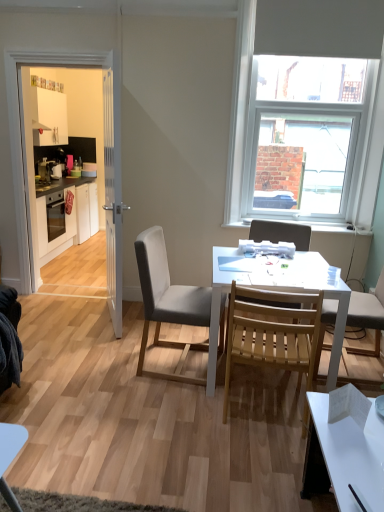
Question: Is point coord(109,138) closer or farther from the camera than point coord(307,355)?

Choices:
 (A) closer
 (B) farther

Answer: (B)

Question: From their relative heights in the image, would you say white wooden door at left is taller or shorter than natural wood chair at center, the 2th chair when ordered from left to right?

Choices:
 (A) short
 (B) tall

Answer: (B)

Question: Which object is the farthest from the white matte window at upper right?

Choices:
 (A) white wooden door at left
 (B) metallic silver toaster at left
 (C) natural wood chair at center, the 2th chair when ordered from left to right
 (D) wooden slats chair at center, marked as the third chair in a left-to-right arrangement
 (E) white matte table at center

Answer: (B)

Question: Which object is the closest to the white matte table at center?

Choices:
 (A) wooden slats chair at center, the first chair viewed from the right
 (B) velvet grey chair at center, which is the first chair in left-to-right order
 (C) natural wood chair at center, the 2th chair when ordered from left to right
 (D) white glossy cabinets at left
 (E) white wooden door at left

Answer: (C)